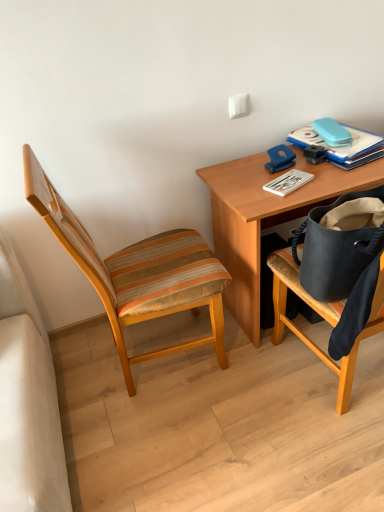
Find the location of a particular element. vacant space to the right of white matte paperback book at upper right, which is the 2th paperback book from top to bottom is located at coordinates (331, 173).